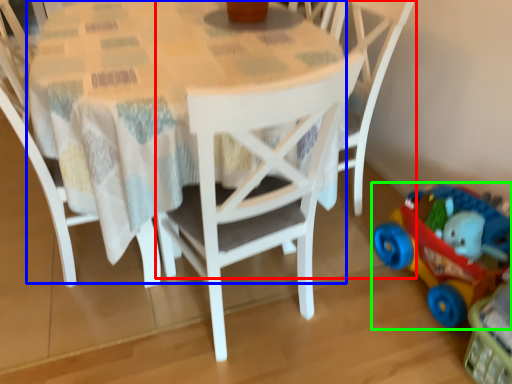
Question: Considering the real-world distances, which object is farthest from chair (highlighted by a red box)? round table (highlighted by a blue box) or toy (highlighted by a green box)?

Choices:
 (A) round table
 (B) toy

Answer: (A)